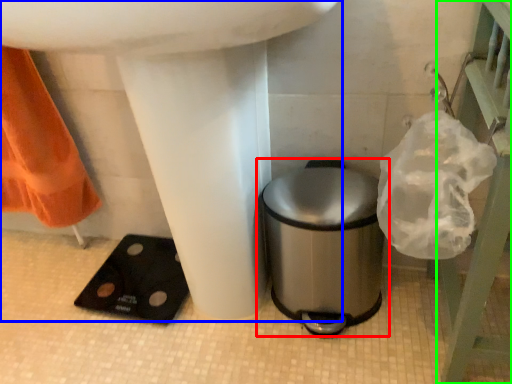
Question: Estimate the real-world distances between objects in this image. Which object is farther from waste container (highlighted by a red box), sink (highlighted by a blue box) or balustrade (highlighted by a green box)?

Choices:
 (A) sink
 (B) balustrade

Answer: (B)